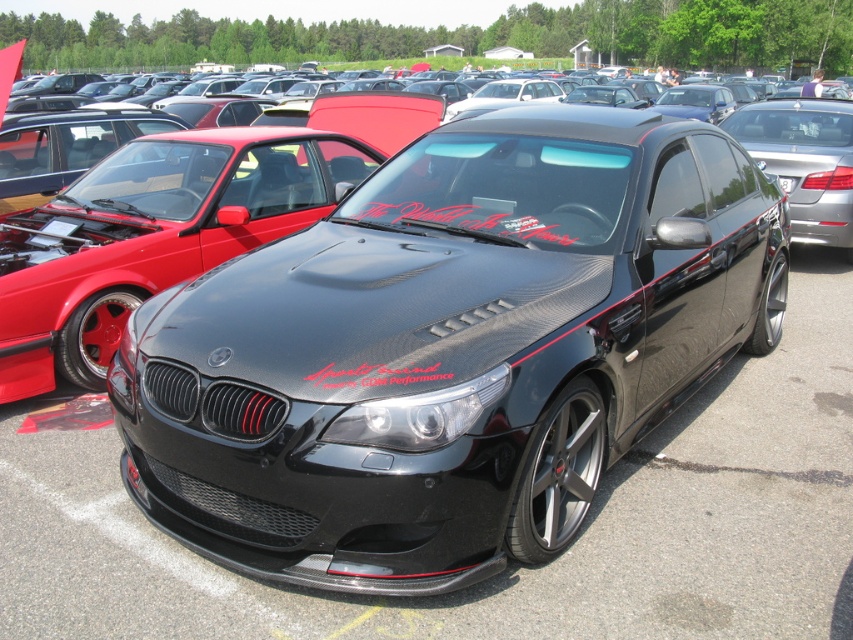
Question: Among these points, which one is nearest to the camera?

Choices:
 (A) 799,166
 (B) 786,193

Answer: (B)

Question: Which point is closer to the camera taking this photo?

Choices:
 (A) (740, 108)
 (B) (793, 182)

Answer: (B)

Question: Does black carbon fiber sedan at center have a larger size compared to black carbon fiber license plate at center?

Choices:
 (A) no
 (B) yes

Answer: (B)

Question: Is black carbon fiber sedan at center in front of black carbon fiber license plate at center?

Choices:
 (A) no
 (B) yes

Answer: (A)

Question: Is black carbon fiber sedan at center positioned behind black carbon fiber license plate at center?

Choices:
 (A) yes
 (B) no

Answer: (A)